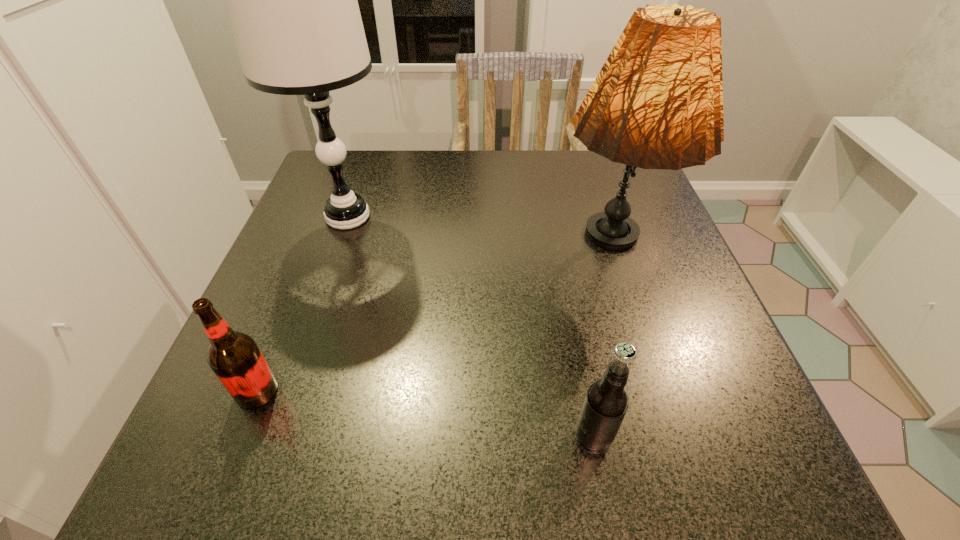
The height and width of the screenshot is (540, 960). Find the location of `free region at the left edge`. free region at the left edge is located at coordinates (328, 228).

In the image, there is a desktop. Where is `free space at the right edge`? free space at the right edge is located at coordinates (752, 406).

Where is `blank space at the far left corner of the desktop`? blank space at the far left corner of the desktop is located at coordinates (371, 189).

Locate an element on the screen. The height and width of the screenshot is (540, 960). vacant space at the near left corner of the desktop is located at coordinates (199, 448).

Locate an element on the screen. Image resolution: width=960 pixels, height=540 pixels. free location at the far right corner of the desktop is located at coordinates (579, 167).

At what (x,y) coordinates should I click in order to perform the action: click on vacant space at the near right corner of the desktop. Please return your answer as a coordinate pair (x, y). This screenshot has width=960, height=540. Looking at the image, I should click on (738, 447).

The width and height of the screenshot is (960, 540). In order to click on vacant space that's between the second nearest object and the right root beer in this screenshot , I will do `click(425, 414)`.

Where is `vacant space that is in between the table lamp and the lampshade`? The width and height of the screenshot is (960, 540). vacant space that is in between the table lamp and the lampshade is located at coordinates (477, 237).

Find the location of a particular element. This screenshot has height=540, width=960. free space between the nearer root beer and the lampshade is located at coordinates (600, 348).

Where is `empty location between the lampshade and the nearer root beer`? empty location between the lampshade and the nearer root beer is located at coordinates 600,348.